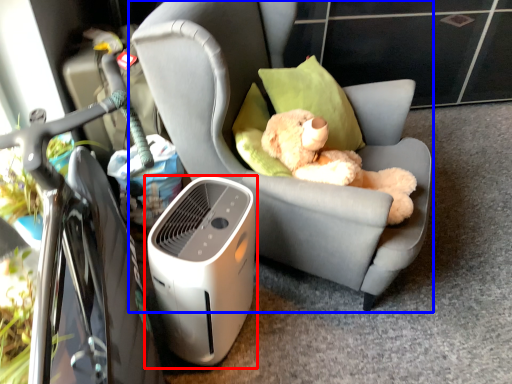
Question: Which point is further to the camera, home appliance (highlighted by a red box) or chair (highlighted by a blue box)?

Choices:
 (A) home appliance
 (B) chair

Answer: (A)